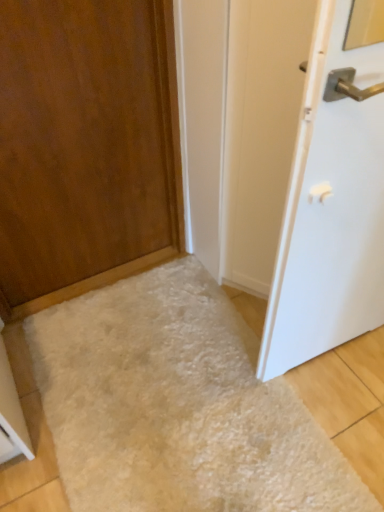
Question: From the image's perspective, relative to wooden door at left, the second door in the right-to-left sequence, is white glossy door at right, positioned as the 1th door in right-to-left order, above or below?

Choices:
 (A) below
 (B) above

Answer: (A)

Question: Relative to wooden door at left, the first door in the left-to-right sequence, is white glossy door at right, positioned as the 1th door in right-to-left order, in front or behind?

Choices:
 (A) front
 (B) behind

Answer: (A)

Question: Which of these objects is positioned farthest from the white fluffy rug at lower center?

Choices:
 (A) white glossy door at right, which is the second door from left to right
 (B) wooden door at left, the second door in the right-to-left sequence

Answer: (B)

Question: Considering the real-world distances, which object is closest to the white fluffy rug at lower center?

Choices:
 (A) white glossy door at right, which is the second door from left to right
 (B) wooden door at left, the first door in the left-to-right sequence

Answer: (A)